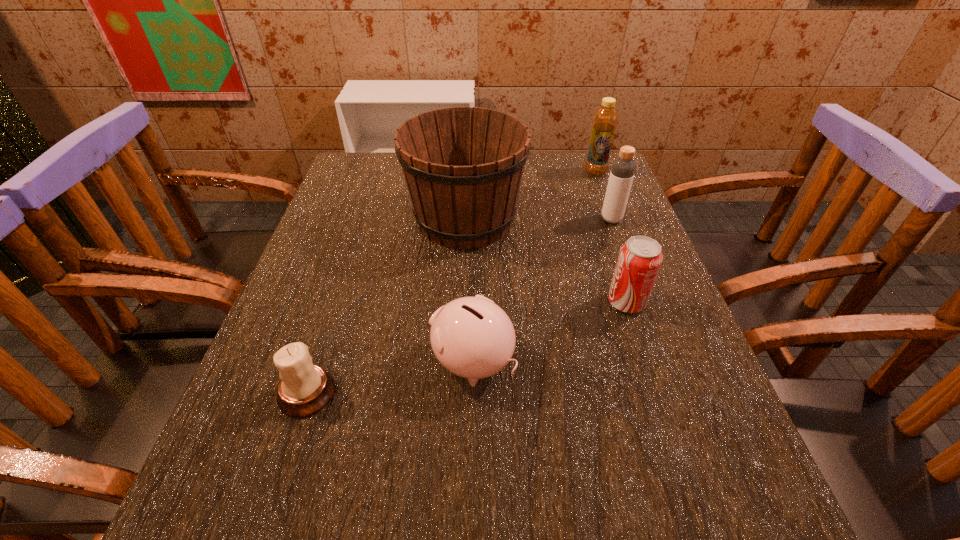
Identify the location of empty space between the nearer bottle and the farther bottle. (603, 195).

Locate an element on the screen. The image size is (960, 540). free space between the piggy bank and the soda can is located at coordinates coord(549,332).

This screenshot has height=540, width=960. I want to click on free space between the farthest object and the piggy bank, so click(x=534, y=267).

Image resolution: width=960 pixels, height=540 pixels. What are the coordinates of `unoccupied position between the nearer bottle and the farther bottle` in the screenshot? It's located at (603, 195).

Image resolution: width=960 pixels, height=540 pixels. Find the location of `vacant point located between the piggy bank and the farther bottle`. vacant point located between the piggy bank and the farther bottle is located at coordinates (534, 267).

Locate an element on the screen. the fifth closest object to the farther bottle is located at coordinates (304, 389).

I want to click on the second closest object relative to the candle holder, so click(x=463, y=166).

Image resolution: width=960 pixels, height=540 pixels. I want to click on vacant area in the image that satisfies the following two spatial constraints: 1. on the back side of the wine bucket; 2. on the left side of the farthest object, so click(467, 172).

You are a GUI agent. You are given a task and a screenshot of the screen. Output one action in this format:
    pyautogui.click(x=<x>, y=<y>)
    Task: Click on the free location that satisfies the following two spatial constraints: 1. on the back side of the leftmost object; 2. on the left side of the piggy bank
    
    Given the screenshot: What is the action you would take?
    pyautogui.click(x=317, y=362)

This screenshot has width=960, height=540. I want to click on vacant space that satisfies the following two spatial constraints: 1. on the back side of the farther bottle; 2. on the right side of the nearer bottle, so click(594, 172).